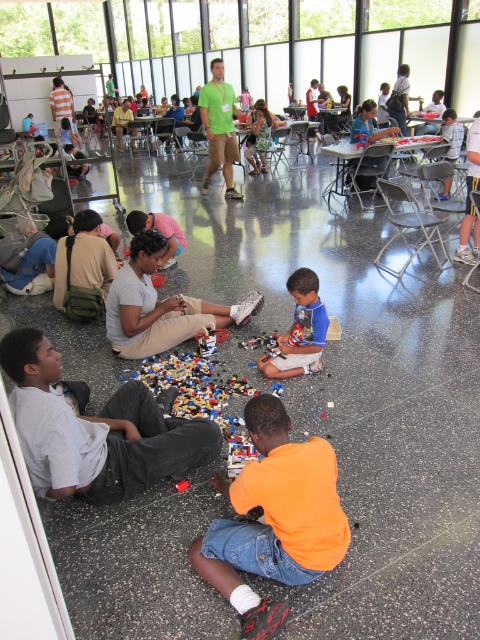
Question: Which point is closer to the camera?

Choices:
 (A) orange matte shirt at lower center
 (B) blue matte shirt at center
 (C) gray cotton pants at lower left

Answer: (A)

Question: In this image, where is gray cotton pants at lower left located relative to orange matte shirt at lower center?

Choices:
 (A) left
 (B) right

Answer: (A)

Question: Is orange matte shirt at lower center to the right of blue matte shirt at center from the viewer's perspective?

Choices:
 (A) yes
 (B) no

Answer: (B)

Question: Does gray cotton pants at lower left appear on the right side of blue matte shirt at center?

Choices:
 (A) yes
 (B) no

Answer: (B)

Question: Which of these objects is positioned farthest from the gray cotton pants at lower left?

Choices:
 (A) blue matte shirt at center
 (B) orange matte shirt at lower center

Answer: (A)

Question: Which of the following is the farthest from the observer?

Choices:
 (A) orange matte shirt at lower center
 (B) blue matte shirt at center

Answer: (B)